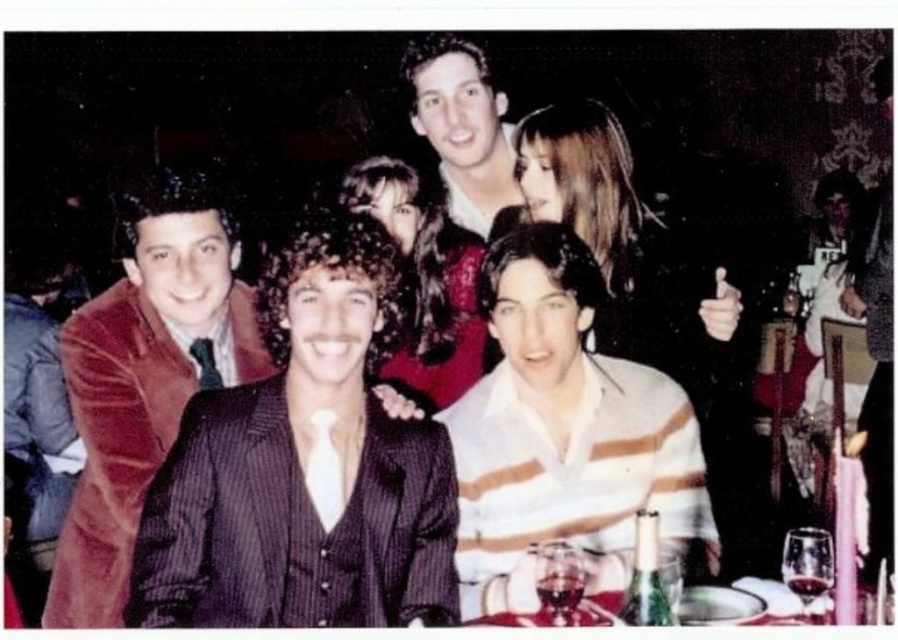
Question: Which is nearer to the smooth brown hair at upper center?

Choices:
 (A) shiny white shirt at upper center
 (B) velvet red suit at left
 (C) shiny dark hair at center
 (D) shiny silver tray at lower center

Answer: (C)

Question: Is white striped sweater at center positioned in front of velvet red suit at left?

Choices:
 (A) no
 (B) yes

Answer: (B)

Question: Which of the following is the closest to the observer?

Choices:
 (A) shiny white shirt at upper center
 (B) white striped sweater at center
 (C) smooth brown hair at upper center

Answer: (B)

Question: Among these objects, which one is farthest from the camera?

Choices:
 (A) velvet red suit at left
 (B) shiny dark hair at center
 (C) white striped sweater at center
 (D) smooth brown hair at upper center

Answer: (D)

Question: Can you confirm if shiny dark hair at center is positioned to the left of shiny silver tray at lower center?

Choices:
 (A) yes
 (B) no

Answer: (A)

Question: Can you confirm if shiny dark hair at center is positioned to the right of shiny white shirt at upper center?

Choices:
 (A) no
 (B) yes

Answer: (A)